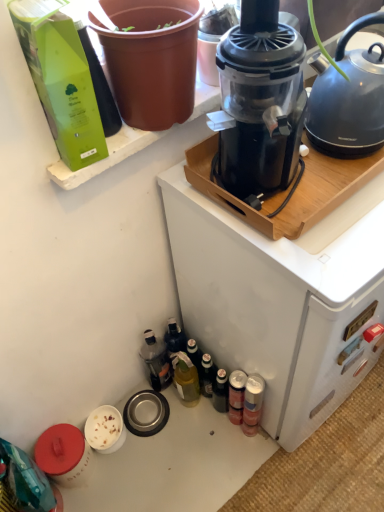
Locate an element on the screen. free location in front of translucent plastic bottle at lower left, the 1th bottle in the left-to-right sequence is located at coordinates (175, 437).